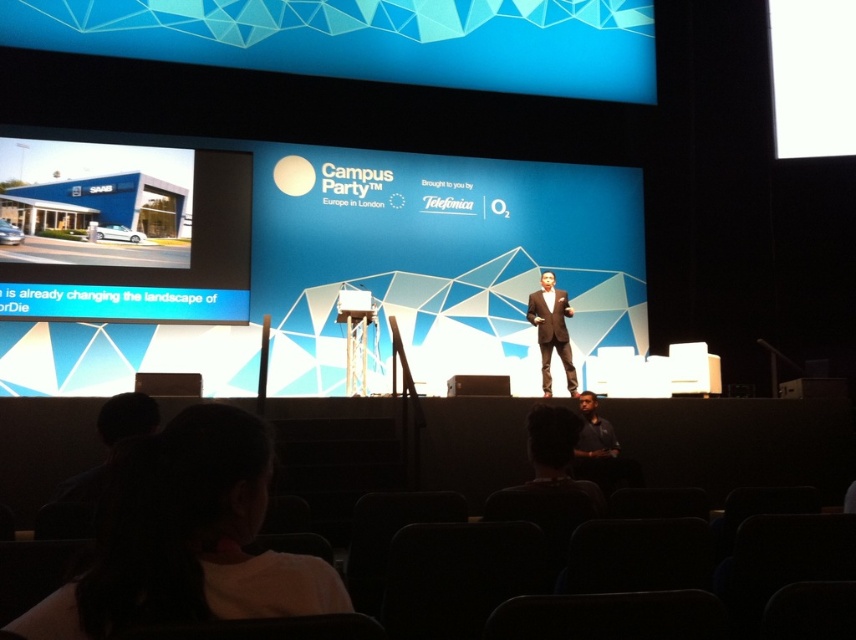
Question: Which point appears closest to the camera in this image?

Choices:
 (A) (474, 388)
 (B) (645, 100)
 (C) (370, 300)
 (D) (556, 291)

Answer: (A)

Question: Which object is positioned closest to the matte black suit at center?

Choices:
 (A) white plastic projector at center
 (B) brown suit at center

Answer: (A)

Question: Does blue geometric pattern at upper center appear over white t-shirt at lower left?

Choices:
 (A) yes
 (B) no

Answer: (A)

Question: Among these objects, which one is farthest from the camera?

Choices:
 (A) white plastic projector at center
 (B) blue geometric pattern at upper center
 (C) white t-shirt at lower left

Answer: (B)

Question: Where is blue geometric pattern at upper center located in relation to white plastic projector at center in the image?

Choices:
 (A) above
 (B) below

Answer: (A)

Question: Does white t-shirt at lower left have a lesser width compared to brown suit at center?

Choices:
 (A) yes
 (B) no

Answer: (A)